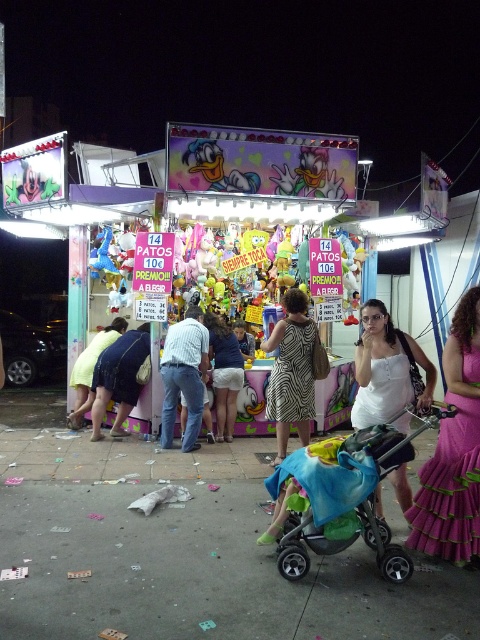
You are standing in front of the carnival game booth and want to reach both points marked in the image. Which point, point (314, 472) or point (231, 417), is closer to you?

Point (314, 472) is closer to the viewer than point (231, 417).

You are a photographer at a fairground. You have a camera and need to take a photo of the white satin dress at center displayed in the game booth. The dress is behind glass. Can you take the photo without moving closer than 3.79 meters? Explain why.

The white satin dress at center and camera are 3.79 meters apart from each other, so you can take the photo without moving closer because the distance is exactly 3.79 meters.

You are at a fairground and want to take a photo of the white lace skirt at center and the black plastic baby carriage at lower right. Which object should you focus on first if you want to capture both in the same frame without moving the camera?

The black plastic baby carriage at lower right is positioned on the right side of the white lace skirt at center, so you should focus on the white lace skirt at center first to ensure both are in frame.